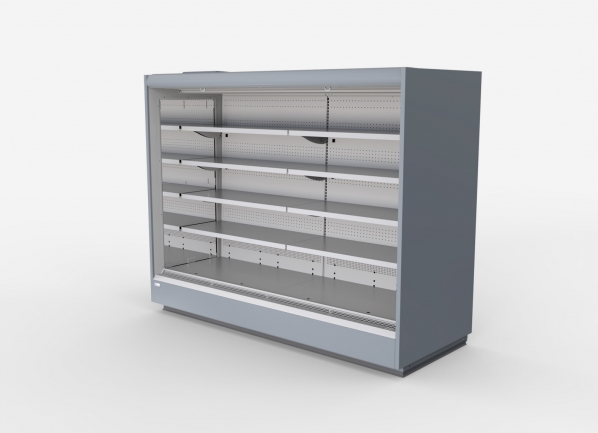
Identify the location of supports for shelf. The image size is (598, 433). click(x=315, y=142), click(x=210, y=136).